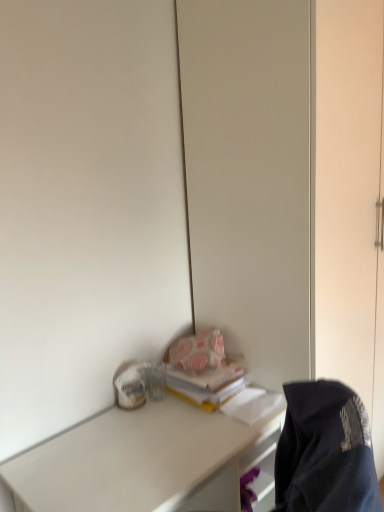
Image resolution: width=384 pixels, height=512 pixels. Describe the element at coordinates (325, 451) in the screenshot. I see `dark blue fabric jacket at lower right` at that location.

This screenshot has width=384, height=512. In order to click on white matte desk at lower left in this screenshot , I will do `click(144, 461)`.

Locate an element on the screen. This screenshot has height=512, width=384. dark blue fabric jacket at lower right is located at coordinates (325, 451).

Is yellow matte book at center bigger or smaller than white matte desk at lower left?

yellow matte book at center is smaller than white matte desk at lower left.

Who is taller, yellow matte book at center or white matte desk at lower left?

white matte desk at lower left.

Which is more to the right, yellow matte book at center or white matte desk at lower left?

From the viewer's perspective, yellow matte book at center appears more on the right side.

Is point (216, 392) positioned in front of point (87, 468)?

No, (216, 392) is behind (87, 468).

From a real-world perspective, is dark blue fabric jacket at lower right located beneath white matte desk at lower left?

No, from a real-world perspective, dark blue fabric jacket at lower right is not below white matte desk at lower left.

Does point (364, 510) appear closer or farther from the camera than point (157, 439)?

Clearly, point (364, 510) is closer to the camera than point (157, 439).

Is dark blue fabric jacket at lower right placed right next to white matte desk at lower left?

dark blue fabric jacket at lower right and white matte desk at lower left are clearly separated.

Locate an element on the screen. The width and height of the screenshot is (384, 512). desk lying behind the dark blue fabric jacket at lower right is located at coordinates (144, 461).

Can you confirm if white matte desk at lower left is smaller than dark blue fabric jacket at lower right?

Incorrect, white matte desk at lower left is not smaller in size than dark blue fabric jacket at lower right.

Consider the image. Is white matte desk at lower left taller than dark blue fabric jacket at lower right?

Yes.

From the image's perspective, is white matte desk at lower left above or below dark blue fabric jacket at lower right?

From the image's perspective, white matte desk at lower left appears below dark blue fabric jacket at lower right.

Is white matte desk at lower left further to camera compared to dark blue fabric jacket at lower right?

Yes, it is behind dark blue fabric jacket at lower right.

From a real-world perspective, is dark blue fabric jacket at lower right on top of yellow matte book at center?

No, from a real-world perspective, dark blue fabric jacket at lower right is not on top of yellow matte book at center.

Is dark blue fabric jacket at lower right oriented away from yellow matte book at center?

No.

Find the location of a particular element. The width and height of the screenshot is (384, 512). jacket to the right of yellow matte book at center is located at coordinates (325, 451).

Who is shorter, dark blue fabric jacket at lower right or yellow matte book at center?

With less height is yellow matte book at center.

Can you confirm if yellow matte book at center is wider than dark blue fabric jacket at lower right?

Correct, the width of yellow matte book at center exceeds that of dark blue fabric jacket at lower right.

Looking at this image, considering the relative positions of yellow matte book at center and dark blue fabric jacket at lower right in the image provided, is yellow matte book at center to the left of dark blue fabric jacket at lower right from the viewer's perspective?

Yes.

Is yellow matte book at center oriented towards dark blue fabric jacket at lower right?

Yes.

Considering the relative positions of yellow matte book at center and dark blue fabric jacket at lower right in the image provided, is yellow matte book at center behind dark blue fabric jacket at lower right?

Yes, it is.

Is white matte desk at lower left positioned beyond the bounds of yellow matte book at center?

white matte desk at lower left is positioned outside yellow matte book at center.

From a real-world perspective, which is physically below, white matte desk at lower left or yellow matte book at center?

From a 3D spatial view, white matte desk at lower left is below.

Considering the sizes of objects white matte desk at lower left and yellow matte book at center in the image provided, who is bigger, white matte desk at lower left or yellow matte book at center?

With larger size is white matte desk at lower left.

The width and height of the screenshot is (384, 512). What are the coordinates of `book that is behind the white matte desk at lower left` in the screenshot? It's located at (203, 369).

The image size is (384, 512). I want to click on desk on the left of dark blue fabric jacket at lower right, so click(x=144, y=461).

Based on their spatial positions, is dark blue fabric jacket at lower right or yellow matte book at center closer to white matte desk at lower left?

yellow matte book at center is closer to white matte desk at lower left.

From the picture: From the image, which object appears to be nearer to dark blue fabric jacket at lower right, yellow matte book at center or white matte desk at lower left?

Among the two, white matte desk at lower left is located nearer to dark blue fabric jacket at lower right.

Which object lies further to the anchor point yellow matte book at center, dark blue fabric jacket at lower right or white matte desk at lower left?

dark blue fabric jacket at lower right lies further to yellow matte book at center than the other object.

Considering their positions, is yellow matte book at center positioned further to white matte desk at lower left than dark blue fabric jacket at lower right?

Among the two, dark blue fabric jacket at lower right is located further to white matte desk at lower left.

Based on their spatial positions, is white matte desk at lower left or yellow matte book at center closer to dark blue fabric jacket at lower right?

white matte desk at lower left lies closer to dark blue fabric jacket at lower right than the other object.

Based on the photo, based on their spatial positions, is white matte desk at lower left or dark blue fabric jacket at lower right further from yellow matte book at center?

dark blue fabric jacket at lower right is further to yellow matte book at center.

Identify the location of desk between dark blue fabric jacket at lower right and yellow matte book at center from front to back. (144, 461).